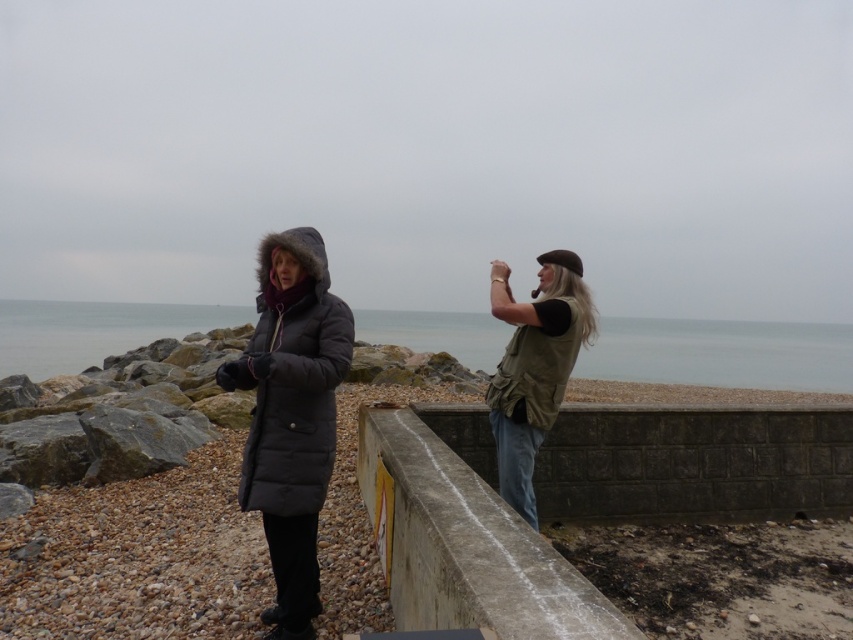
You are standing on the pebble beach and want to take a photo of the gray water at center. The concrete barrier with a yellow warning sign is blocking your view. Can you move to the point at coordinates point (722, 353) to get a clear shot?

The gray water at center is located at point (722, 353), so moving to that point would place you directly at the gray water, which may not provide a clear view if the concrete barrier is still obstructing. Consider moving around the barrier to find an unobstructed path to the point.

You are standing on the pebble beach and want to place your backpack on the ground between the concrete ledge at center and the matte black coat at center. Based on their positions, which object should you place the backpack closer to to ensure it is between them?

The concrete ledge at center is to the right of the matte black coat at center, so placing the backpack closer to the matte black coat at center would keep it between the two objects.